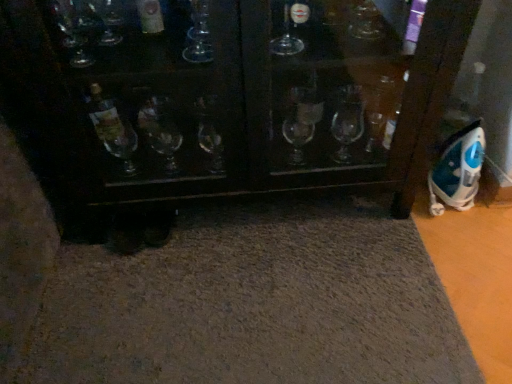
What do you see at coordinates (255, 303) in the screenshot?
I see `gray carpet at lower center` at bounding box center [255, 303].

You are a GUI agent. You are given a task and a screenshot of the screen. Output one action in this format:
    pyautogui.click(x=<x>, y=<y>)
    Task: Click on the gray carpet at lower center
    
    Given the screenshot: What is the action you would take?
    [x=255, y=303]

What is the approximate width of blue plastic iron at right?

blue plastic iron at right is 6.32 inches wide.

In order to face blue plastic iron at right, should I rotate leftwards or rightwards?

Turn right by 25.594 degrees to look at blue plastic iron at right.

Describe the element at coordinates (457, 170) in the screenshot. I see `blue plastic iron at right` at that location.

What is the approximate height of blue plastic iron at right?

blue plastic iron at right is 10.95 inches in height.

Where is `blue plastic iron at right`? The width and height of the screenshot is (512, 384). blue plastic iron at right is located at coordinates (457, 170).

This screenshot has width=512, height=384. I want to click on gray carpet at lower center, so click(x=255, y=303).

Considering the positions of objects blue plastic iron at right and gray carpet at lower center in the image provided, who is more to the left, blue plastic iron at right or gray carpet at lower center?

gray carpet at lower center is more to the left.

Which object is further away from the camera taking this photo, blue plastic iron at right or gray carpet at lower center?

blue plastic iron at right is further away from the camera.

Is point (468, 156) less distant than point (29, 376)?

That is False.

From the image's perspective, is blue plastic iron at right above gray carpet at lower center?

Yes, from the image's perspective, blue plastic iron at right is on top of gray carpet at lower center.

From a real-world perspective, which is physically above, blue plastic iron at right or gray carpet at lower center?

blue plastic iron at right.

Between blue plastic iron at right and gray carpet at lower center, which one has smaller width?

Thinner between the two is blue plastic iron at right.

Is blue plastic iron at right taller or shorter than gray carpet at lower center?

In the image, blue plastic iron at right appears to be taller than gray carpet at lower center.

Who is smaller, blue plastic iron at right or gray carpet at lower center?

blue plastic iron at right.

Is gray carpet at lower center inside blue plastic iron at right?

No, gray carpet at lower center is located outside of blue plastic iron at right.

Is blue plastic iron at right beside gray carpet at lower center?

No, blue plastic iron at right is not beside gray carpet at lower center.

Could you tell me if blue plastic iron at right is turned towards gray carpet at lower center?

No, blue plastic iron at right is not turned towards gray carpet at lower center.

Where is `appliance behind the gray carpet at lower center`? This screenshot has height=384, width=512. appliance behind the gray carpet at lower center is located at coordinates (457, 170).

Which is more to the left, gray carpet at lower center or blue plastic iron at right?

From the viewer's perspective, gray carpet at lower center appears more on the left side.

Considering the positions of objects gray carpet at lower center and blue plastic iron at right in the image provided, who is in front, gray carpet at lower center or blue plastic iron at right?

Positioned in front is gray carpet at lower center.

Considering the points (123, 361) and (444, 161), which point is in front, point (123, 361) or point (444, 161)?

The point (123, 361) is closer to the camera.

From the image's perspective, is gray carpet at lower center located above blue plastic iron at right?

No.

From a real-world perspective, does gray carpet at lower center sit lower than blue plastic iron at right?

Yes, from a real-world perspective, gray carpet at lower center is below blue plastic iron at right.

Can you confirm if gray carpet at lower center is thinner than blue plastic iron at right?

In fact, gray carpet at lower center might be wider than blue plastic iron at right.

Can you confirm if gray carpet at lower center is shorter than blue plastic iron at right?

Indeed, gray carpet at lower center has a lesser height compared to blue plastic iron at right.

Which of these two, gray carpet at lower center or blue plastic iron at right, is bigger?

With larger size is gray carpet at lower center.

Is gray carpet at lower center outside of blue plastic iron at right?

Yes, gray carpet at lower center is not within blue plastic iron at right.

Is gray carpet at lower center not near blue plastic iron at right?

No, there isn't a large distance between gray carpet at lower center and blue plastic iron at right.

Could you tell me if gray carpet at lower center is facing blue plastic iron at right?

No, gray carpet at lower center is not aimed at blue plastic iron at right.

This screenshot has height=384, width=512. What are the coordinates of `appliance above the gray carpet at lower center (from the image's perspective)` in the screenshot? It's located at (457, 170).

Locate an element on the screen. appliance on the right of gray carpet at lower center is located at coordinates (457, 170).

The image size is (512, 384). I want to click on bath mat below the blue plastic iron at right (from a real-world perspective), so click(x=255, y=303).